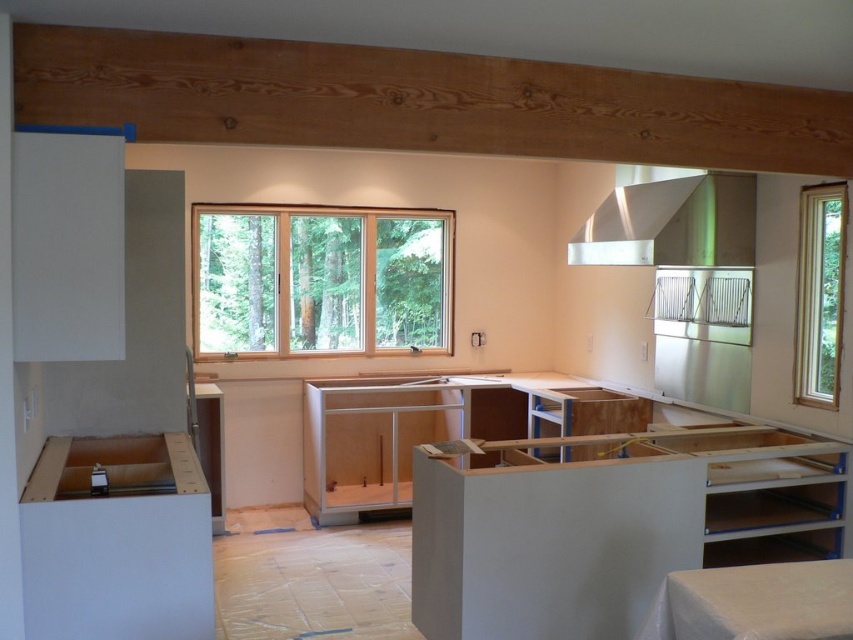
You are standing in the room and want to check the view outside the clear glass window at center. Can you see the satin silver exhaust hood at upper right through the window?

The satin silver exhaust hood at upper right is behind the clear glass window at center, so it cannot be seen through the window.

You are a construction worker standing at the center of the room. You need to install a new light fixture that must be placed exactly at the center of the room. The satin silver exhaust hood at upper right is located at point 0.350, 0.789. Will the new light fixture interfere with the exhaust hood?

The satin silver exhaust hood at upper right is located at point (672,224), so the new light fixture placed at the center of the room will not interfere with it since their positions are different.